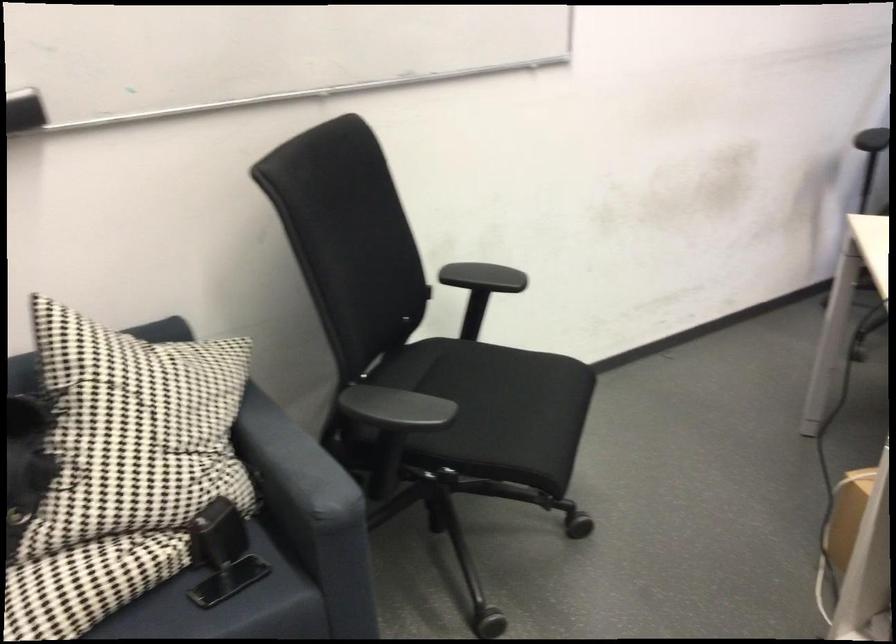
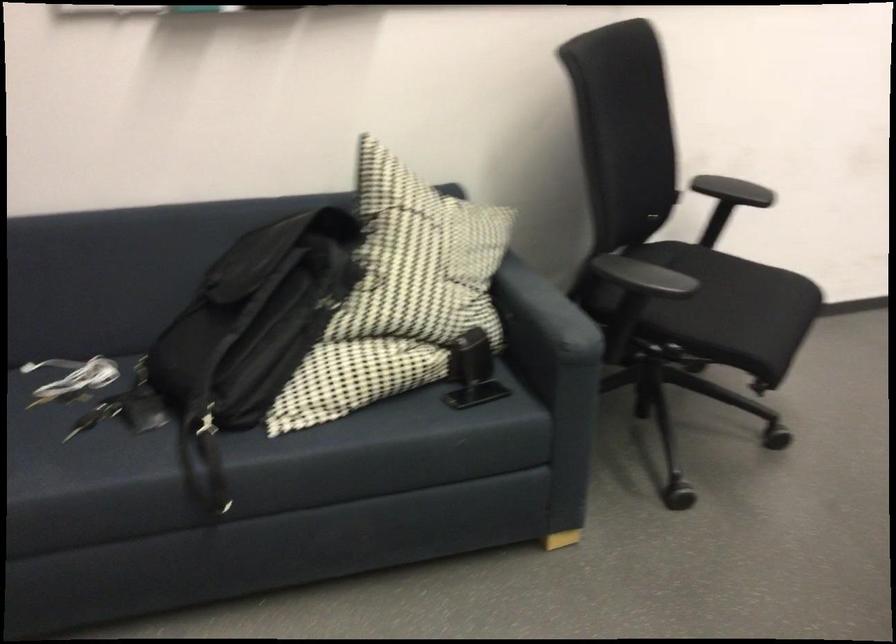
Based on the photo, what movement of the cameraman would produce the second image?

The cameraman walked toward left, backward.